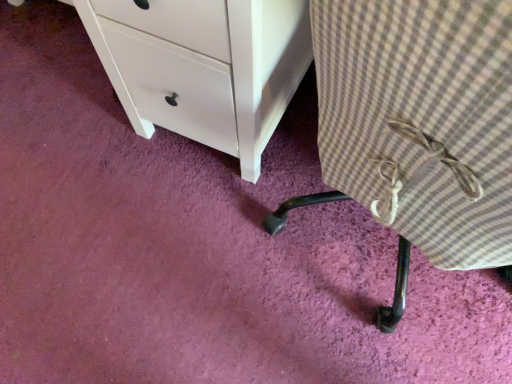
The image size is (512, 384). What are the coordinates of `brown checkered fabric chair at lower right` in the screenshot? It's located at (418, 127).

What do you see at coordinates (418, 127) in the screenshot?
I see `brown checkered fabric chair at lower right` at bounding box center [418, 127].

Locate an element on the screen. This screenshot has width=512, height=384. brown checkered fabric chair at lower right is located at coordinates (418, 127).